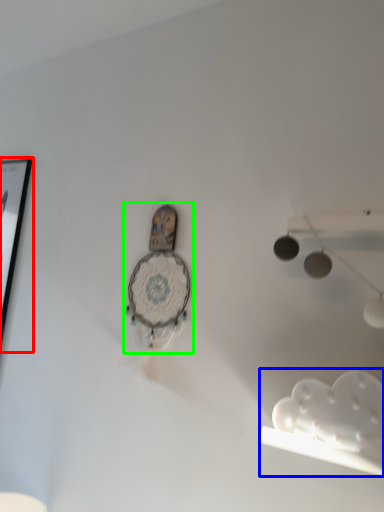
Question: Which object is the farthest from picture frame (highlighted by a red box)? Choose among these: lamp (highlighted by a blue box) or clock (highlighted by a green box).

Choices:
 (A) lamp
 (B) clock

Answer: (A)